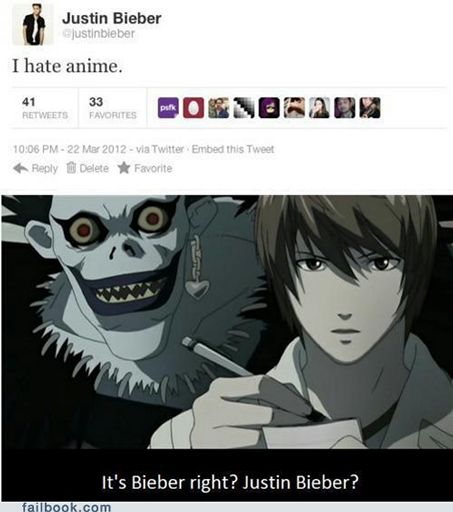
Image resolution: width=453 pixels, height=512 pixels. Find the location of `pen`. pen is located at coordinates (210, 360).